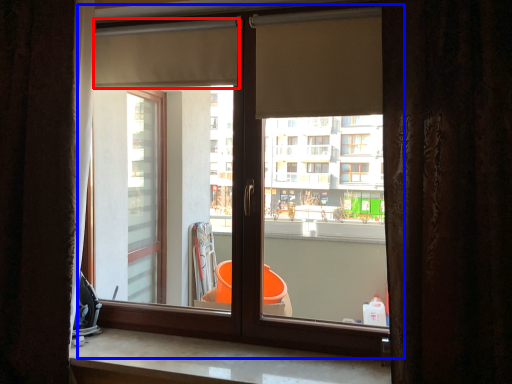
Question: Which object is further to the camera taking this photo, shutter (highlighted by a red box) or window (highlighted by a blue box)?

Choices:
 (A) shutter
 (B) window

Answer: (A)